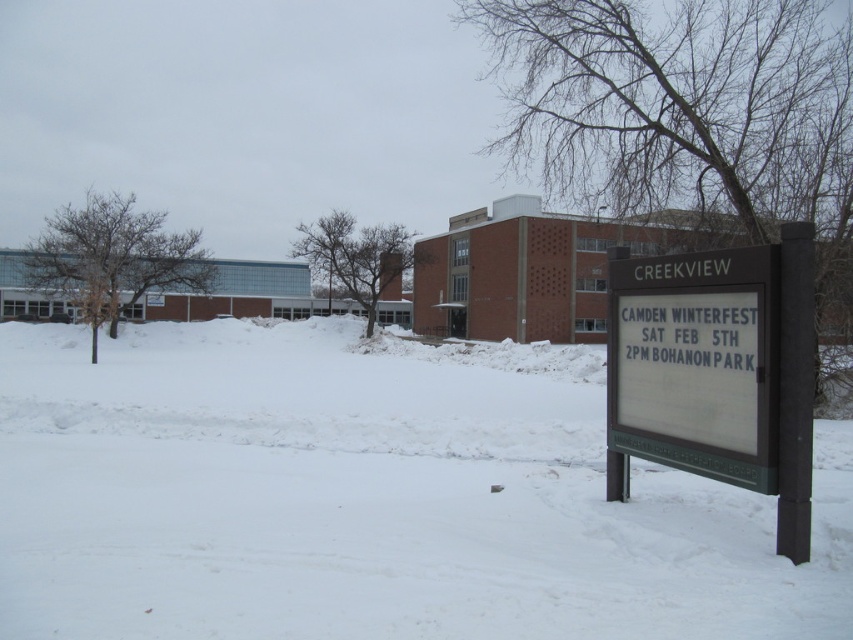
This screenshot has height=640, width=853. What do you see at coordinates (369, 499) in the screenshot? I see `white powdery snow at center` at bounding box center [369, 499].

Does point (90, 368) come in front of point (755, 465)?

No, (90, 368) is behind (755, 465).

Describe the element at coordinates (369, 499) in the screenshot. The image size is (853, 640). I see `white powdery snow at center` at that location.

At what (x,y) coordinates should I click in order to perform the action: click on white powdery snow at center. Please return your answer as a coordinate pair (x, y). This screenshot has height=640, width=853. Looking at the image, I should click on (369, 499).